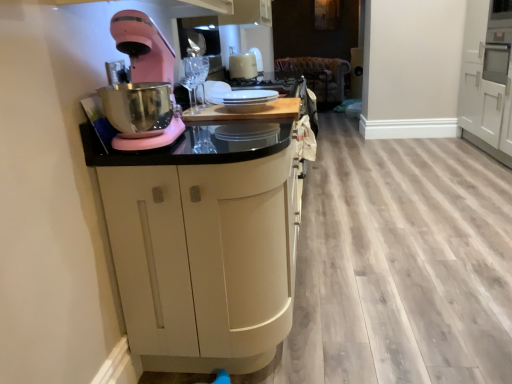
Where is `free space to the right of matte black cabinet at center, which is the second cabinetry in back-to-front order`? This screenshot has height=384, width=512. free space to the right of matte black cabinet at center, which is the second cabinetry in back-to-front order is located at coordinates (396, 304).